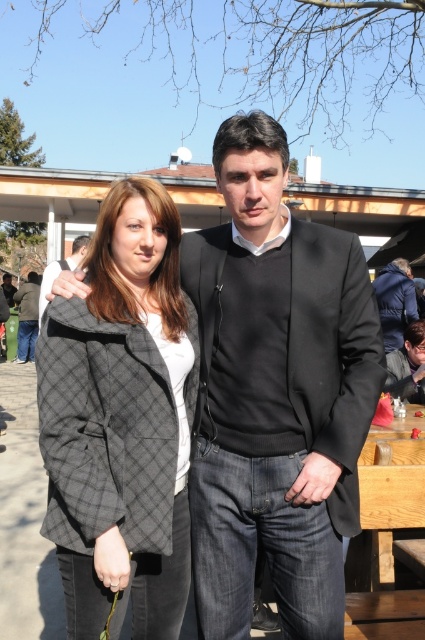
Question: Is wooden picnic table at lower right to the left of dark blue jacket at right from the viewer's perspective?

Choices:
 (A) yes
 (B) no

Answer: (A)

Question: Which object is closer to the camera taking this photo?

Choices:
 (A) dark blue jacket at right
 (B) black matte blazer at center
 (C) wooden picnic table at lower right
 (D) plaid wool coat at center

Answer: (D)

Question: Estimate the real-world distances between objects in this image. Which object is closer to the black matte blazer at center?

Choices:
 (A) wooden picnic table at lower right
 (B) dark gray suit at center

Answer: (A)

Question: Can you confirm if wooden picnic table at lower right is thinner than dark gray suit at center?

Choices:
 (A) no
 (B) yes

Answer: (B)

Question: Is black matte blazer at center bigger than dark gray suit at center?

Choices:
 (A) no
 (B) yes

Answer: (A)

Question: Which object is closer to the camera taking this photo?

Choices:
 (A) black matte blazer at center
 (B) wooden picnic table at lower right
 (C) dark gray suit at center

Answer: (A)